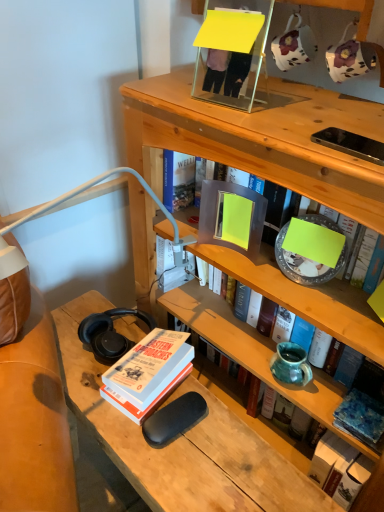
Question: From a real-world perspective, is teal ceramic vase at middle right over hardcover book at upper center, which is the third book in bottom-to-top order?

Choices:
 (A) no
 (B) yes

Answer: (A)

Question: Is teal ceramic vase at middle right at the left side of hardcover book at upper center, which is the third book in bottom-to-top order?

Choices:
 (A) no
 (B) yes

Answer: (A)

Question: From the image's perspective, is teal ceramic vase at middle right located above hardcover book at upper center, which is the third book in bottom-to-top order?

Choices:
 (A) no
 (B) yes

Answer: (A)

Question: From a real-world perspective, is teal ceramic vase at middle right below hardcover book at upper center, which is counted as the 2th book, starting from the top?

Choices:
 (A) yes
 (B) no

Answer: (A)

Question: Considering the relative positions of teal ceramic vase at middle right and hardcover book at upper center, which is the third book in bottom-to-top order, in the image provided, is teal ceramic vase at middle right in front of hardcover book at upper center, which is the third book in bottom-to-top order,?

Choices:
 (A) no
 (B) yes

Answer: (A)

Question: From the image's perspective, is hardcover book at lower left, acting as the 2th book starting from the bottom, above or below blue textured fabric at lower right, marked as the 4th book in a top-to-bottom arrangement?

Choices:
 (A) below
 (B) above

Answer: (B)

Question: Would you say hardcover book at lower left, acting as the 2th book starting from the bottom, is inside or outside blue textured fabric at lower right, marked as the 4th book in a top-to-bottom arrangement?

Choices:
 (A) outside
 (B) inside

Answer: (A)

Question: Is hardcover book at lower left, which is the 3th book in top-to-bottom order, taller or shorter than blue textured fabric at lower right, placed as the first book when sorted from bottom to top?

Choices:
 (A) tall
 (B) short

Answer: (A)

Question: Considering the positions of hardcover book at lower left, which is the 3th book in top-to-bottom order, and blue textured fabric at lower right, placed as the first book when sorted from bottom to top, in the image, is hardcover book at lower left, which is the 3th book in top-to-bottom order, bigger or smaller than blue textured fabric at lower right, placed as the first book when sorted from bottom to top,?

Choices:
 (A) big
 (B) small

Answer: (A)

Question: Considering the positions of blue textured fabric at lower right, placed as the first book when sorted from bottom to top, and matte gray book at center, arranged as the first book when viewed from the top, in the image, is blue textured fabric at lower right, placed as the first book when sorted from bottom to top, taller or shorter than matte gray book at center, arranged as the first book when viewed from the top,?

Choices:
 (A) short
 (B) tall

Answer: (A)

Question: Would you say blue textured fabric at lower right, placed as the first book when sorted from bottom to top, is to the left or to the right of matte gray book at center, placed as the 4th book when sorted from bottom to top, in the picture?

Choices:
 (A) left
 (B) right

Answer: (B)

Question: Is blue textured fabric at lower right, placed as the first book when sorted from bottom to top, in front of or behind matte gray book at center, arranged as the first book when viewed from the top, in the image?

Choices:
 (A) front
 (B) behind

Answer: (B)

Question: Is point (336, 425) closer or farther from the camera than point (160, 194)?

Choices:
 (A) closer
 (B) farther

Answer: (A)

Question: From the image's perspective, is hardcover book at upper center, which is the third book in bottom-to-top order, above or below blue textured fabric at lower right, placed as the first book when sorted from bottom to top?

Choices:
 (A) below
 (B) above

Answer: (B)

Question: Looking at their shapes, would you say hardcover book at upper center, which is the third book in bottom-to-top order, is wider or thinner than blue textured fabric at lower right, marked as the 4th book in a top-to-bottom arrangement?

Choices:
 (A) wide
 (B) thin

Answer: (A)